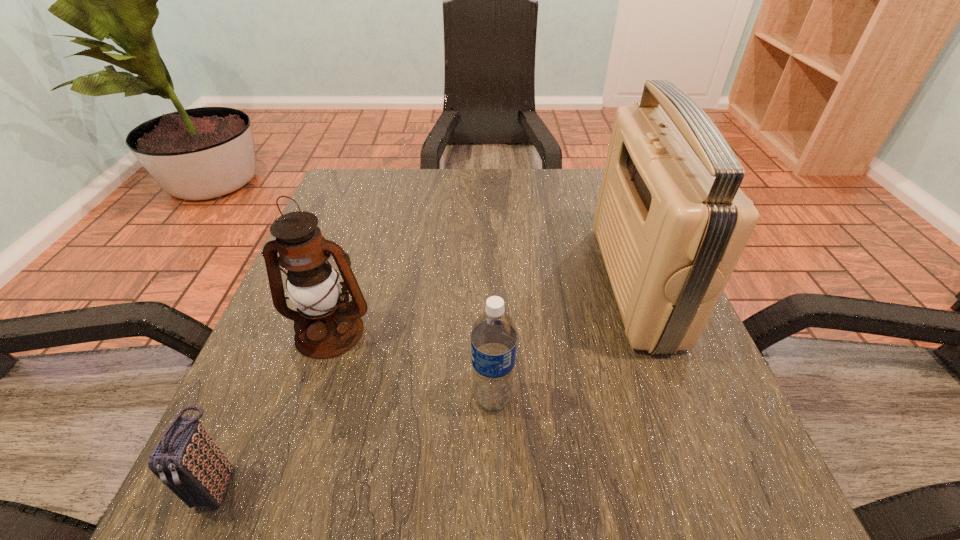
You are a GUI agent. You are given a task and a screenshot of the screen. Output one action in this format:
    pyautogui.click(x=<x>, y=<y>)
    Task: Click on the vacant space located on the side of the lantern, there is a wick adjustment knob
    The width and height of the screenshot is (960, 540).
    Given the screenshot: What is the action you would take?
    pyautogui.click(x=289, y=453)

At what (x,y) coordinates should I click in order to perform the action: click on blank space located on the back of the second shortest object. Please return your answer as a coordinate pair (x, y). This screenshot has height=540, width=960. Looking at the image, I should click on click(491, 333).

The image size is (960, 540). What are the coordinates of `object situated at the near edge` in the screenshot? It's located at (186, 459).

Locate an element on the screen. The width and height of the screenshot is (960, 540). lantern located at the left edge is located at coordinates (313, 286).

The height and width of the screenshot is (540, 960). In order to click on clutch bag at the left edge in this screenshot , I will do `click(186, 459)`.

The width and height of the screenshot is (960, 540). What are the coordinates of `object present at the right edge` in the screenshot? It's located at (671, 222).

The height and width of the screenshot is (540, 960). Find the location of `object present at the near left corner`. object present at the near left corner is located at coordinates (186, 459).

Image resolution: width=960 pixels, height=540 pixels. Identify the location of vacant point at the far edge. (453, 173).

In the image, there is a desktop. At what (x,y) coordinates should I click in order to perform the action: click on free region at the left edge. Please return your answer as a coordinate pair (x, y). The height and width of the screenshot is (540, 960). Looking at the image, I should click on (261, 394).

Where is `vacant space at the right edge of the desktop`? This screenshot has height=540, width=960. vacant space at the right edge of the desktop is located at coordinates (713, 458).